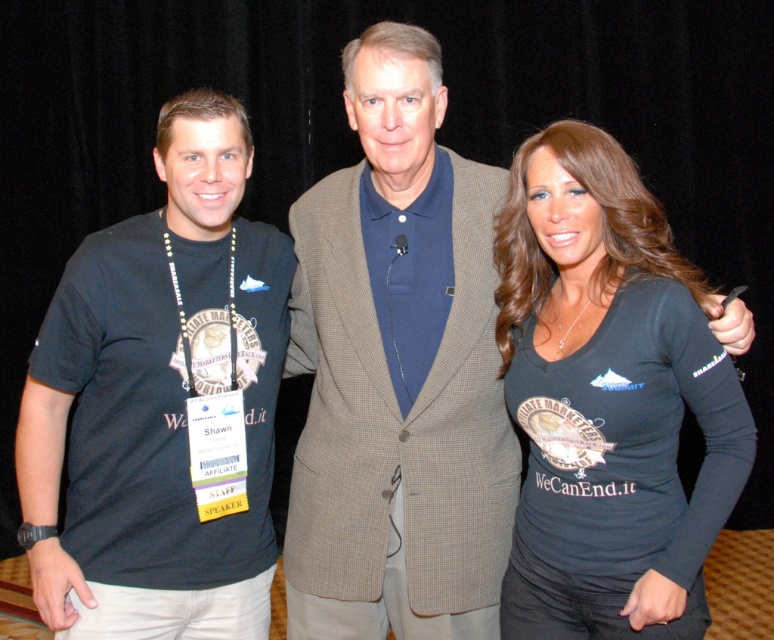
You are at a conference and need to identify the speaker based on their clothing. Which of the following is true? The blue cotton polo shirt at center is worn by a speaker, or the black matte shirt at right is worn by a speaker?

The blue cotton polo shirt at center is located above black matte shirt at right, so the blue cotton polo shirt at center is worn by a speaker.